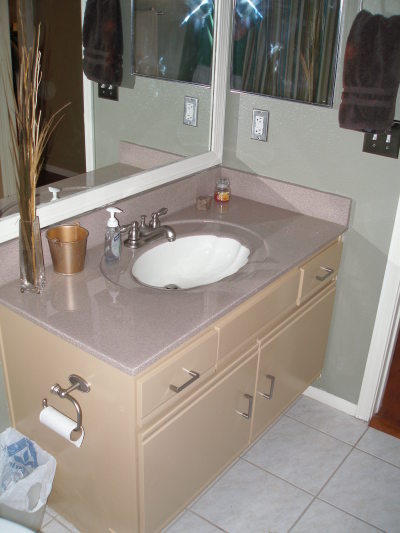
Locate an element on the screen. The image size is (400, 533). sink is located at coordinates (178, 254), (206, 245).